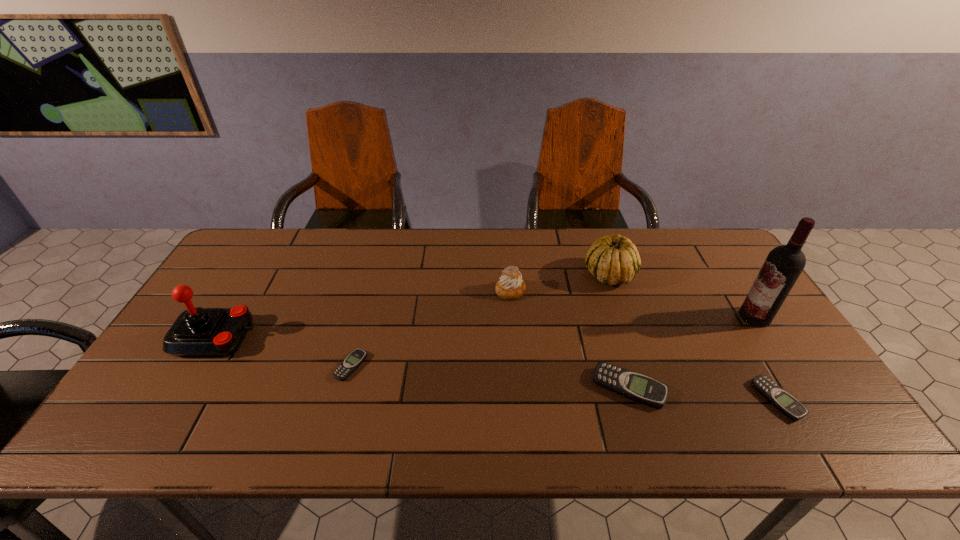
In the image, there is a desktop. In order to click on vacant space at the far left corner in this screenshot , I will do `click(289, 237)`.

Locate an element on the screen. The width and height of the screenshot is (960, 540). free space at the far right corner of the desktop is located at coordinates (708, 260).

This screenshot has width=960, height=540. What are the coordinates of `empty space that is in between the second object from left to right and the rightmost beeper` in the screenshot? It's located at (564, 383).

Find the location of a particular element. This screenshot has height=540, width=960. unoccupied area between the gourd and the leftmost object is located at coordinates (413, 306).

The image size is (960, 540). I want to click on unoccupied area between the tallest object and the fifth shortest object, so click(x=682, y=295).

Identify the location of vacant space that is in between the joystick and the second shortest object. The height and width of the screenshot is (540, 960). (497, 368).

Where is `free space that is in between the third tallest object and the tallest beeper`? This screenshot has width=960, height=540. free space that is in between the third tallest object and the tallest beeper is located at coordinates (619, 331).

Locate an element on the screen. The width and height of the screenshot is (960, 540). empty space that is in between the gourd and the tallest object is located at coordinates (682, 295).

Find the location of a particular element. vacant area that lies between the leftmost object and the second tallest beeper is located at coordinates (497, 368).

At what (x,y) coordinates should I click in order to perform the action: click on vacant area between the second tallest object and the shortest beeper. Please return your answer as a coordinate pair (x, y). Looking at the image, I should click on (283, 352).